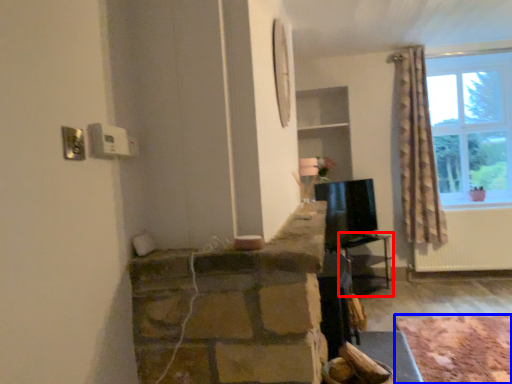
Question: Which object is closer to the camera taking this photo, table (highlighted by a red box) or plain (highlighted by a blue box)?

Choices:
 (A) table
 (B) plain

Answer: (B)